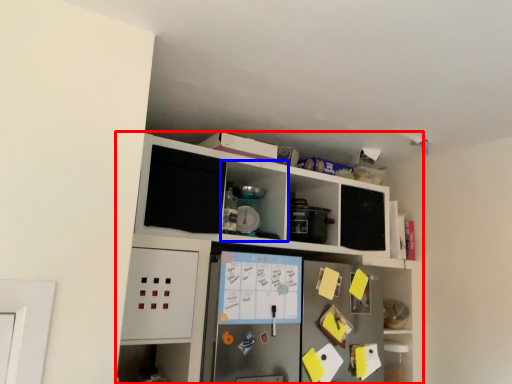
Question: Which point is closer to the camera, cabinetry (highlighted by a red box) or cabinet (highlighted by a blue box)?

Choices:
 (A) cabinetry
 (B) cabinet

Answer: (A)